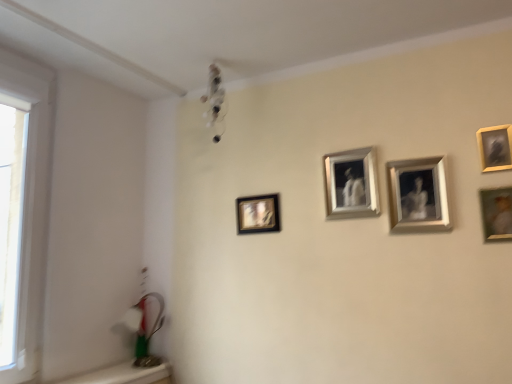
Question: Considering the relative positions of matte black picture frame at center left, positioned as the 5th picture frame in right-to-left order, and metallic silver picture frame at upper right, the third picture frame from the right, in the image provided, is matte black picture frame at center left, positioned as the 5th picture frame in right-to-left order, to the right of metallic silver picture frame at upper right, the third picture frame from the right, from the viewer's perspective?

Choices:
 (A) yes
 (B) no

Answer: (B)

Question: Is matte black picture frame at center left, the first picture frame from the left, thinner than metallic silver picture frame at upper right, the third picture frame from the right?

Choices:
 (A) no
 (B) yes

Answer: (B)

Question: Are matte black picture frame at center left, positioned as the 5th picture frame in right-to-left order, and metallic silver picture frame at upper right, the third picture frame from the right, far apart?

Choices:
 (A) no
 (B) yes

Answer: (A)

Question: Is matte black picture frame at center left, positioned as the 5th picture frame in right-to-left order, aimed at metallic silver picture frame at upper right, the third picture frame from the right?

Choices:
 (A) no
 (B) yes

Answer: (A)

Question: From the image's perspective, does matte black picture frame at center left, positioned as the 5th picture frame in right-to-left order, appear lower than metallic silver picture frame at upper right, the third picture frame from the right?

Choices:
 (A) yes
 (B) no

Answer: (A)

Question: Is point (274, 193) positioned closer to the camera than point (428, 216)?

Choices:
 (A) farther
 (B) closer

Answer: (A)

Question: In the image, is matte black picture frame at center left, positioned as the 5th picture frame in right-to-left order, positioned in front of or behind metallic silver picture frame at upper right, the third picture frame from the right?

Choices:
 (A) front
 (B) behind

Answer: (B)

Question: In terms of height, does matte black picture frame at center left, positioned as the 5th picture frame in right-to-left order, look taller or shorter compared to metallic silver picture frame at upper right, which is the 3th picture frame in left-to-right order?

Choices:
 (A) short
 (B) tall

Answer: (A)

Question: Would you say matte black picture frame at center left, the first picture frame from the left, is inside or outside metallic silver picture frame at upper right, the third picture frame from the right?

Choices:
 (A) inside
 (B) outside

Answer: (B)

Question: In terms of width, does metallic silver picture frame at upper right, which is the 3th picture frame in left-to-right order, look wider or thinner when compared to silver metallic frame at center, the 4th picture frame when ordered from right to left?

Choices:
 (A) thin
 (B) wide

Answer: (B)

Question: From the image's perspective, is metallic silver picture frame at upper right, the third picture frame from the right, located above or below silver metallic frame at center, the 4th picture frame when ordered from right to left?

Choices:
 (A) below
 (B) above

Answer: (A)

Question: In the image, is metallic silver picture frame at upper right, which is the 3th picture frame in left-to-right order, on the left side or the right side of silver metallic frame at center, the 4th picture frame when ordered from right to left?

Choices:
 (A) left
 (B) right

Answer: (B)

Question: In terms of height, does metallic silver picture frame at upper right, which is the 3th picture frame in left-to-right order, look taller or shorter compared to silver metallic frame at center, the 4th picture frame when ordered from right to left?

Choices:
 (A) short
 (B) tall

Answer: (B)

Question: Is metallic silver picture frame at upper right, which is the 3th picture frame in left-to-right order, situated inside transparent glass window at left or outside?

Choices:
 (A) outside
 (B) inside

Answer: (A)

Question: In the image, is metallic silver picture frame at upper right, the third picture frame from the right, positioned in front of or behind transparent glass window at left?

Choices:
 (A) front
 (B) behind

Answer: (B)